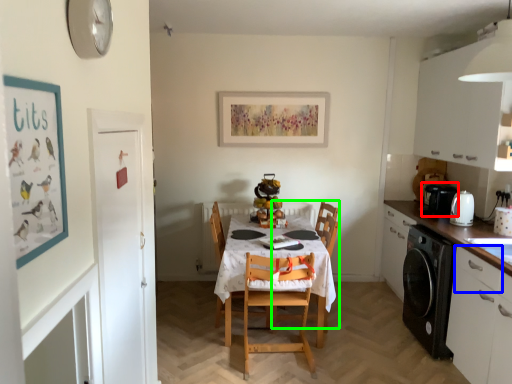
Question: Which is nearer to the coffee machine (highlighted by a red box)? drawer (highlighted by a blue box) or armchair (highlighted by a green box).

Choices:
 (A) drawer
 (B) armchair

Answer: (B)